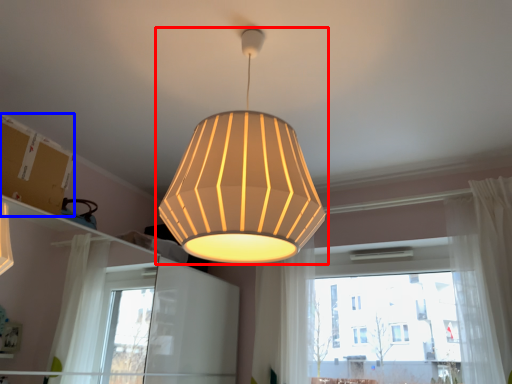
Question: Which of the following is the closest to the observer, lamp (highlighted by a red box) or cardboard box (highlighted by a blue box)?

Choices:
 (A) lamp
 (B) cardboard box

Answer: (A)